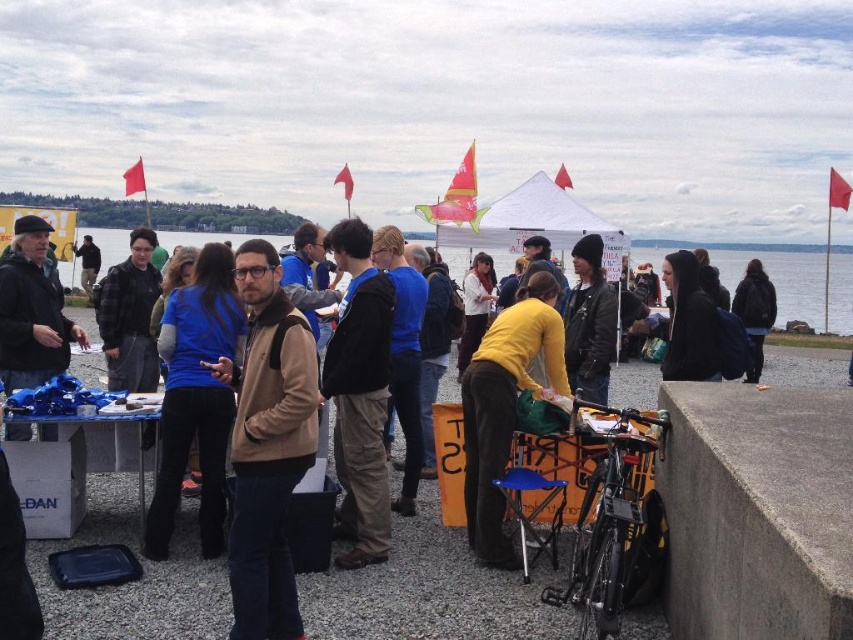
Question: Is the position of concrete ledge at lower right less distant than that of yellow matte shirt at center?

Choices:
 (A) yes
 (B) no

Answer: (A)

Question: Can you confirm if concrete ledge at lower right is positioned above yellow matte shirt at center?

Choices:
 (A) no
 (B) yes

Answer: (A)

Question: Among these objects, which one is farthest from the camera?

Choices:
 (A) black leather jacket at right
 (B) brown suede jacket at center
 (C) yellow matte shirt at center
 (D) concrete ledge at lower right

Answer: (A)

Question: Is concrete ledge at lower right wider than brown suede jacket at center?

Choices:
 (A) yes
 (B) no

Answer: (A)

Question: Among these objects, which one is nearest to the camera?

Choices:
 (A) yellow matte shirt at center
 (B) brown suede jacket at center

Answer: (B)

Question: Among these objects, which one is farthest from the camera?

Choices:
 (A) black leather jacket at right
 (B) yellow matte shirt at center

Answer: (A)